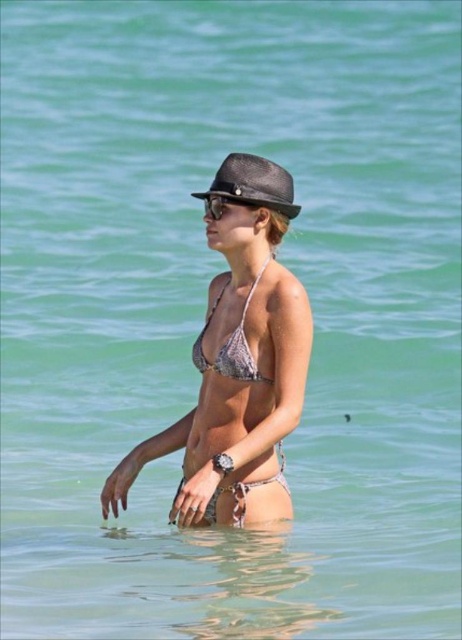
Does metallic silver bikini at center lie in front of black straw fedora at center?

Yes, metallic silver bikini at center is closer to the viewer.

Is point (266, 460) behind point (298, 205)?

No, it is in front of (298, 205).

Who is more forward, (291, 198) or (286, 212)?

Point (286, 212) is in front.

Locate an element on the screen. This screenshot has width=462, height=640. metallic silver bikini at center is located at coordinates (238, 364).

Is point (200, 522) closer to camera compared to point (247, 200)?

No, it is behind (247, 200).

Is point (205, 403) behind point (211, 211)?

Yes, point (205, 403) is farther from viewer.

Locate an element on the screen. This screenshot has width=462, height=640. metallic silver bikini at center is located at coordinates click(x=238, y=364).

I want to click on metallic silver bikini at center, so click(x=238, y=364).

Between point (224, 289) and point (210, 209), which one is positioned behind?

The point (224, 289) is more distant.

This screenshot has height=640, width=462. Describe the element at coordinates (231, 346) in the screenshot. I see `printed fabric bikini top at center` at that location.

You are a GUI agent. You are given a task and a screenshot of the screen. Output one action in this format:
    pyautogui.click(x=<x>, y=<y>)
    Task: Click on the printed fabric bikini top at center
    This screenshot has height=640, width=462.
    Given the screenshot: What is the action you would take?
    pyautogui.click(x=231, y=346)